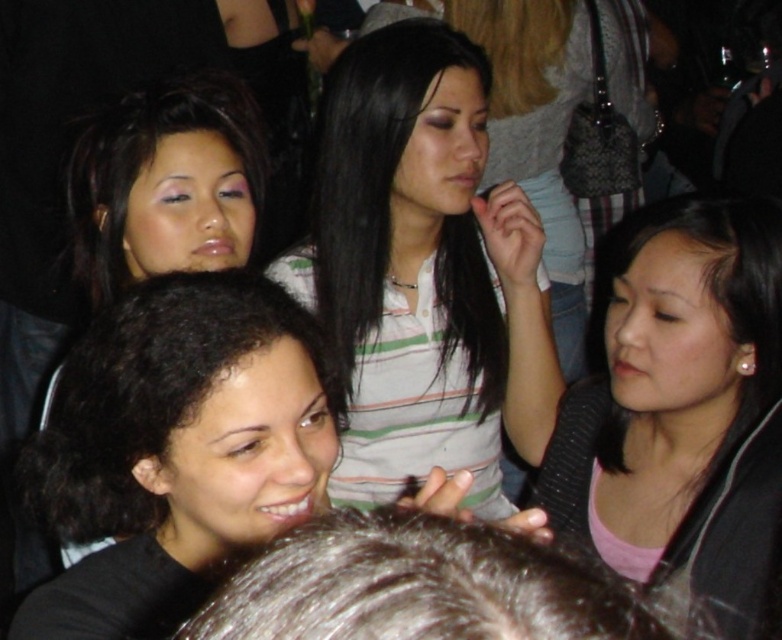
You are a photographer at a social event. You want to capture a photo of the striped cotton shirt at center and the black curly hair at lower left. The camera you are using has a maximum focus range of 25 inches. Can you fit both subjects within the camera focus range?

The distance between the striped cotton shirt at center and the black curly hair at lower left is 25.55 inches, which exceeds the camera focus range of 25 inches. Therefore, you cannot fit both subjects within the camera focus range.

You are a photographer at a social event. You want to take a photo of the black curly hair at lower left and the matte black hair at upper left. Which one is positioned closer to the camera?

The black curly hair at lower left is closer to the viewer than the matte black hair at upper left, so the black curly hair at lower left is positioned closer to the camera.